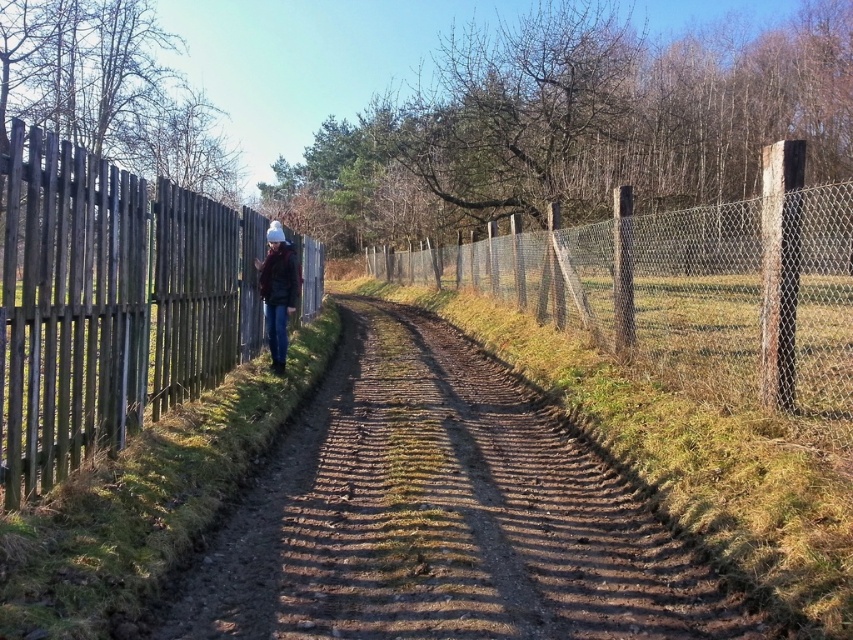
You are standing on the dirt path and want to take a photo of the wooden planks at left and the wire mesh fence at center. Which object will appear closer to the bottom of your camera view?

The wooden planks at left will appear closer to the bottom of the camera view because they are positioned under the wire mesh fence at center.

You are standing on the dirt path and want to take a photo of the wire mesh fence at center and the matte black jacket at center. Which object should you focus on first to ensure it appears sharp in the foreground?

The wire mesh fence at center is in front of the matte black jacket at center, so you should focus on the wire mesh fence at center first to ensure it appears sharp in the foreground.